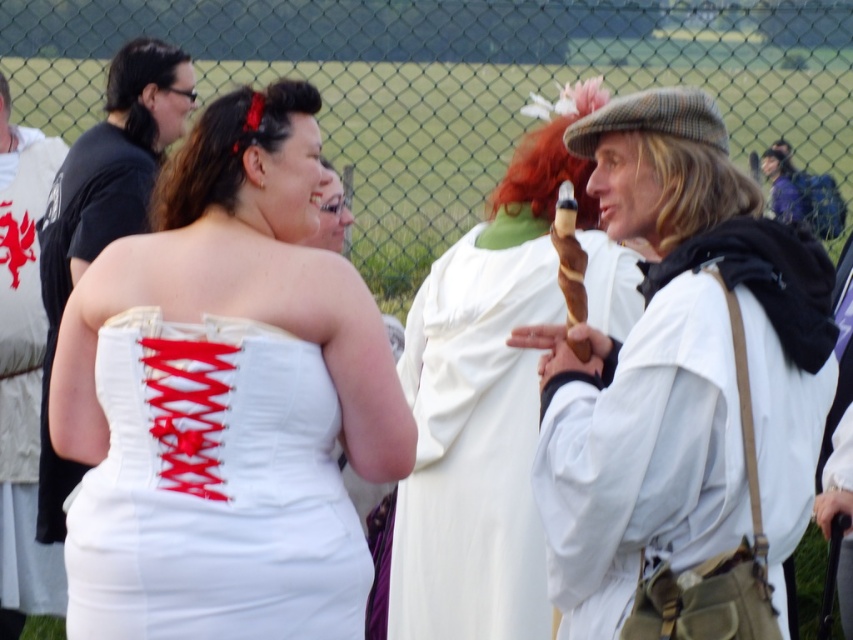
Question: Can you confirm if matte white dress at center is smaller than white cloth at center?

Choices:
 (A) yes
 (B) no

Answer: (B)

Question: Which of the following is the farthest from the observer?

Choices:
 (A) (33, 504)
 (B) (109, 131)

Answer: (A)

Question: Is white satin corset at center smaller than white fabric shirt at upper left?

Choices:
 (A) yes
 (B) no

Answer: (A)

Question: Can you confirm if matte white dress at center is positioned above white fabric shirt at upper left?

Choices:
 (A) no
 (B) yes

Answer: (B)

Question: Among these objects, which one is nearest to the camera?

Choices:
 (A) white satin corset at left
 (B) white cloth at center

Answer: (B)

Question: Which point is farther to the camera?

Choices:
 (A) (444, 296)
 (B) (685, 193)
 (C) (57, 157)
 (D) (146, 465)

Answer: (C)